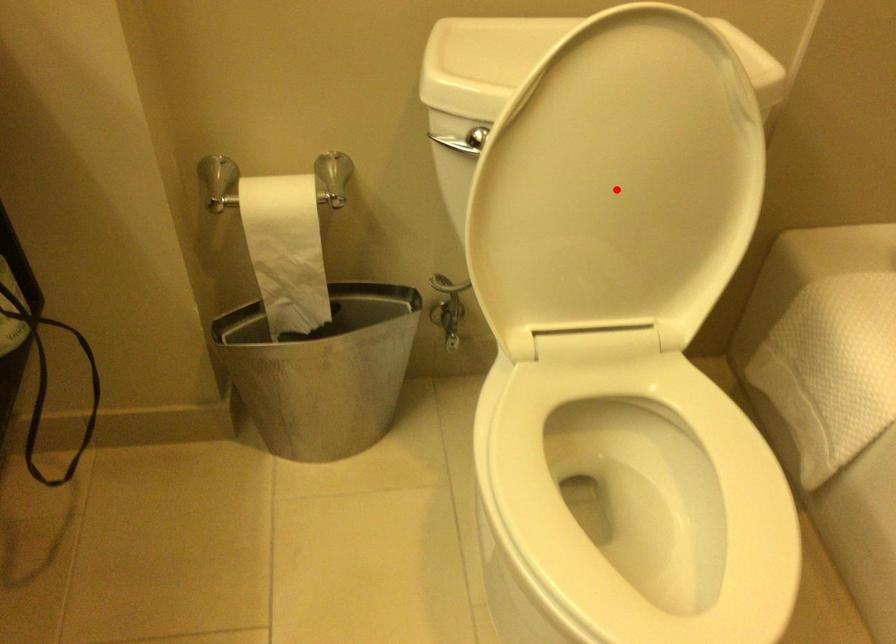
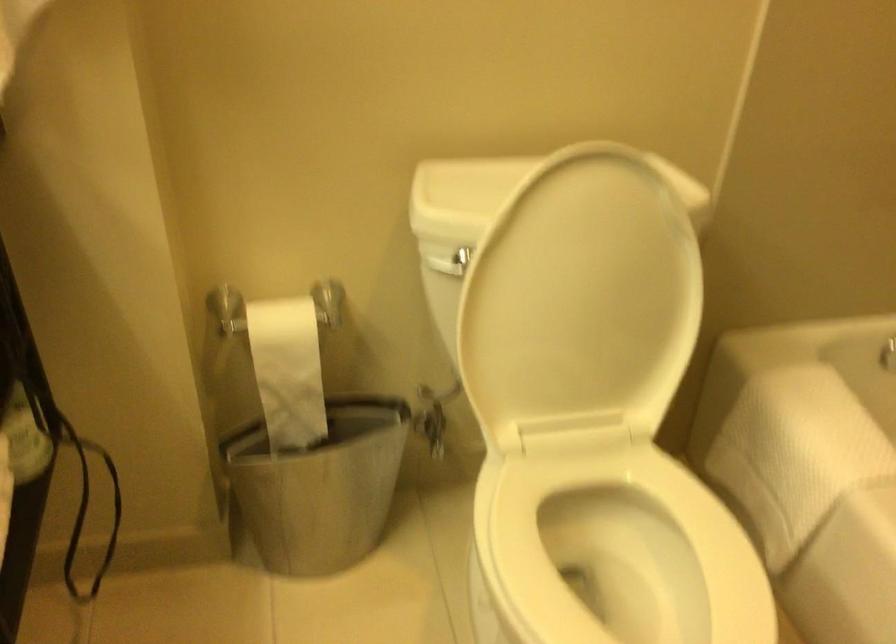
Where in the second image is the point corresponding to the highlighted location from the first image?

(581, 301)